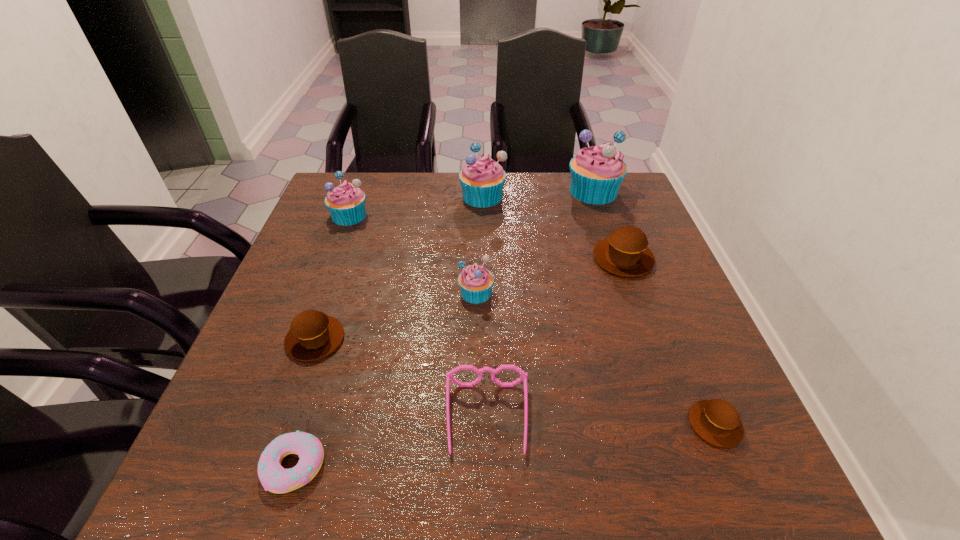
Where is `object situated at the far right corner`? Image resolution: width=960 pixels, height=540 pixels. object situated at the far right corner is located at coordinates (597, 172).

Where is `object located in the near right corner section of the desktop`? The width and height of the screenshot is (960, 540). object located in the near right corner section of the desktop is located at coordinates (716, 421).

Identify the location of vacant space at the far edge of the desktop. (518, 206).

Find the location of a particular element. free spot at the near edge of the desktop is located at coordinates (522, 454).

Where is `vacant area at the right edge of the desktop`? The image size is (960, 540). vacant area at the right edge of the desktop is located at coordinates (633, 320).

In the image, there is a desktop. Where is `blank space at the far left corner`? Image resolution: width=960 pixels, height=540 pixels. blank space at the far left corner is located at coordinates (314, 215).

Find the location of a particular element. free space at the far right corner is located at coordinates (636, 194).

This screenshot has height=540, width=960. What are the coordinates of `vacant point at the near right corner` in the screenshot? It's located at (718, 470).

This screenshot has width=960, height=540. Identify the location of unoccupied area between the biggest blue muffin and the second biggest brown muffin. (454, 265).

The height and width of the screenshot is (540, 960). Identify the location of free space between the sixth farthest muffin and the rightmost blue muffin. (454, 265).